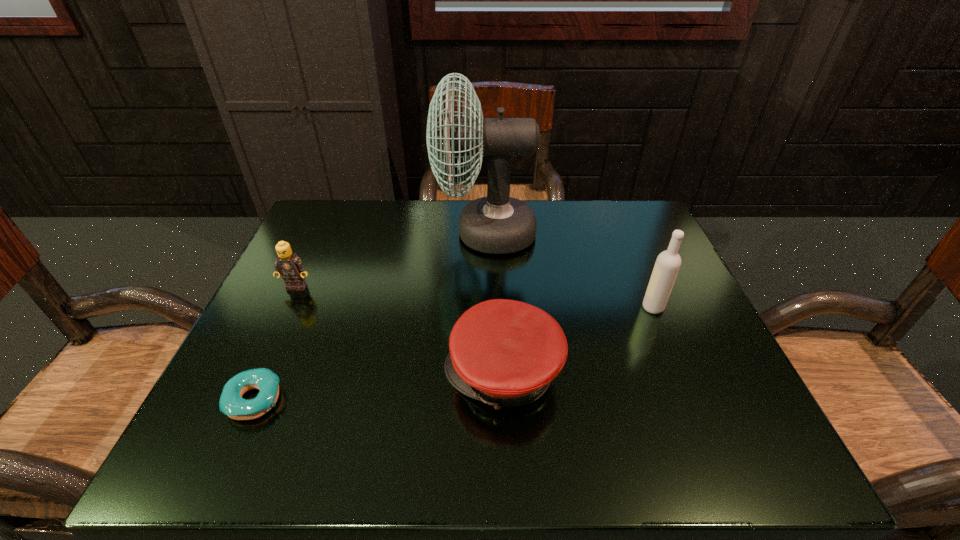
Point out which object is positioned as the third nearest to the vodka. Please provide its 2D coordinates. Your answer should be formatted as a tuple, i.e. [(x, y)], where the tuple contains the x and y coordinates of a point satisfying the conditions above.

[(231, 403)]

In order to click on blank area in the image that satisfies the following two spatial constraints: 1. in front of the third tallest object; 2. on the left side of the fourth shortest object in this screenshot , I will do `click(287, 307)`.

Where is `vacant area in the image that satisfies the following two spatial constraints: 1. in front of the third nearest object; 2. on the left side of the fourth nearest object`? The width and height of the screenshot is (960, 540). vacant area in the image that satisfies the following two spatial constraints: 1. in front of the third nearest object; 2. on the left side of the fourth nearest object is located at coordinates (287, 307).

This screenshot has height=540, width=960. What are the coordinates of `vacant position in the image that satisfies the following two spatial constraints: 1. in front of the tallest object where the airflow is directed; 2. on the right side of the third farthest object` in the screenshot? It's located at pos(487,307).

Find the location of `blank area in the image that satisfies the following two spatial constraints: 1. in front of the doughnut; 2. on the right side of the fourth nearest object`. blank area in the image that satisfies the following two spatial constraints: 1. in front of the doughnut; 2. on the right side of the fourth nearest object is located at coordinates (244, 400).

Where is `free location that satisfies the following two spatial constraints: 1. in front of the fan where the airflow is directed; 2. on the back side of the rightmost object`? free location that satisfies the following two spatial constraints: 1. in front of the fan where the airflow is directed; 2. on the back side of the rightmost object is located at coordinates (487, 307).

The height and width of the screenshot is (540, 960). In order to click on free location that satisfies the following two spatial constraints: 1. in front of the rightmost object; 2. on the right side of the second farthest object in this screenshot , I will do `click(287, 307)`.